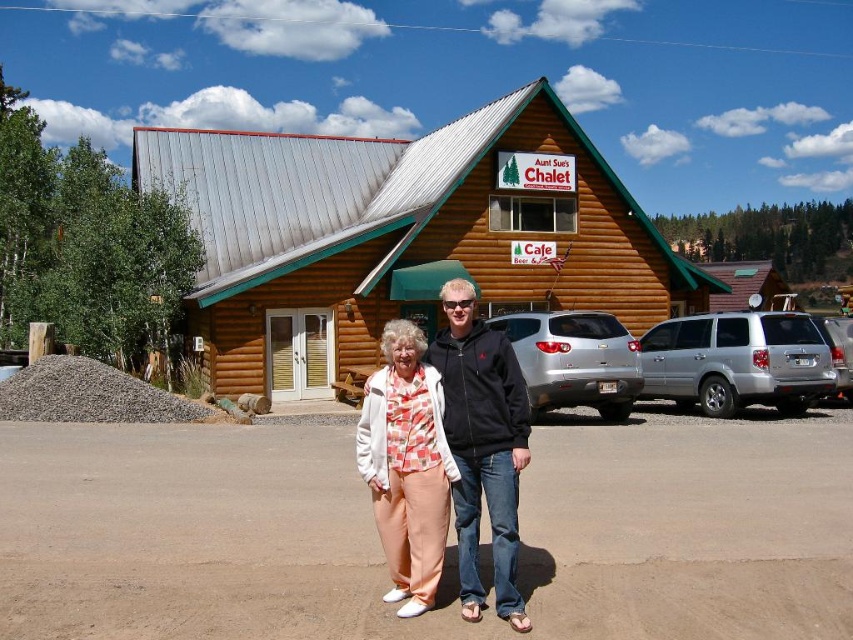
Question: Can you confirm if matte black jacket at center is bigger than silver metallic sedan at right?

Choices:
 (A) yes
 (B) no

Answer: (B)

Question: Which is nearer to the silver metallic sedan at right?

Choices:
 (A) matte black jacket at center
 (B) brown dirt parking lot at center
 (C) matte peach pants at center
 (D) satin silver sedan at center

Answer: (D)

Question: Based on their relative distances, which object is farther from the brown log cabin at center?

Choices:
 (A) silver metallic sedan at right
 (B) matte peach pants at center
 (C) brown dirt parking lot at center

Answer: (B)

Question: Which object appears closest to the camera in this image?

Choices:
 (A) brown log cabin at center
 (B) silver metallic sedan at right
 (C) brown dirt parking lot at center
 (D) brown wooden cabin at center

Answer: (C)

Question: Is matte peach pants at center closer to the viewer compared to silver metallic suv at right?

Choices:
 (A) no
 (B) yes

Answer: (B)

Question: Is brown dirt parking lot at center above silver metallic suv at right?

Choices:
 (A) yes
 (B) no

Answer: (B)